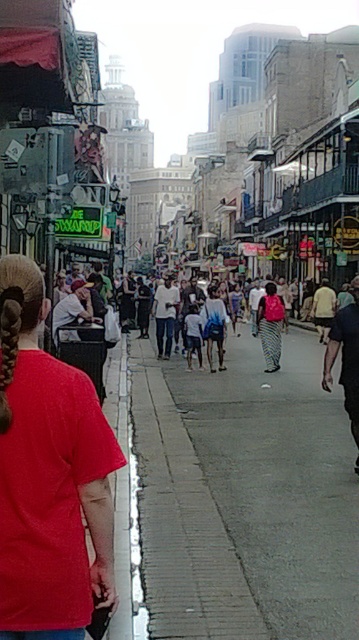
You are a delivery person trying to place a package on the gray concrete sidewalk at center. However, there is a person wearing blue denim shorts at center in the way. Can the package be placed on the sidewalk without moving the person?

The gray concrete sidewalk at center is shorter than blue denim shorts at center, so the sidewalk might not be long enough to accommodate the package without overlapping the person. Therefore, it is advisable to move the person or find another location.

You are a delivery person standing at the entrance of the street. You need to place a package on the gray concrete sidewalk at center. According to the coordinates provided, where exactly should you place the package?

The gray concrete sidewalk at center should be placed at the coordinates point (277, 481).